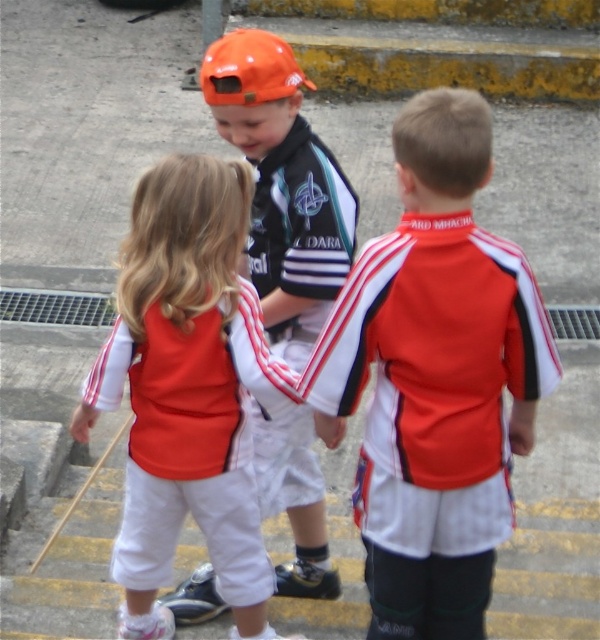
Question: Which object is farther from the camera taking this photo?

Choices:
 (A) orange matte baseball cap at center
 (B) matte black jersey at center
 (C) matte red jersey at center
 (D) matte red tracksuit at center

Answer: (A)

Question: Which object is farther from the camera taking this photo?

Choices:
 (A) orange matte baseball cap at center
 (B) matte red tracksuit at center
 (C) matte black jersey at center

Answer: (A)

Question: Where is matte red tracksuit at center located in relation to matte black jersey at center in the image?

Choices:
 (A) left
 (B) right

Answer: (A)

Question: Among these objects, which one is nearest to the camera?

Choices:
 (A) matte red jersey at center
 (B) orange matte baseball cap at center
 (C) matte red tracksuit at center
 (D) matte black jersey at center

Answer: (A)

Question: Is matte red tracksuit at center thinner than matte black jersey at center?

Choices:
 (A) yes
 (B) no

Answer: (B)

Question: Can you confirm if matte red jersey at center is bigger than orange matte baseball cap at center?

Choices:
 (A) no
 (B) yes

Answer: (B)